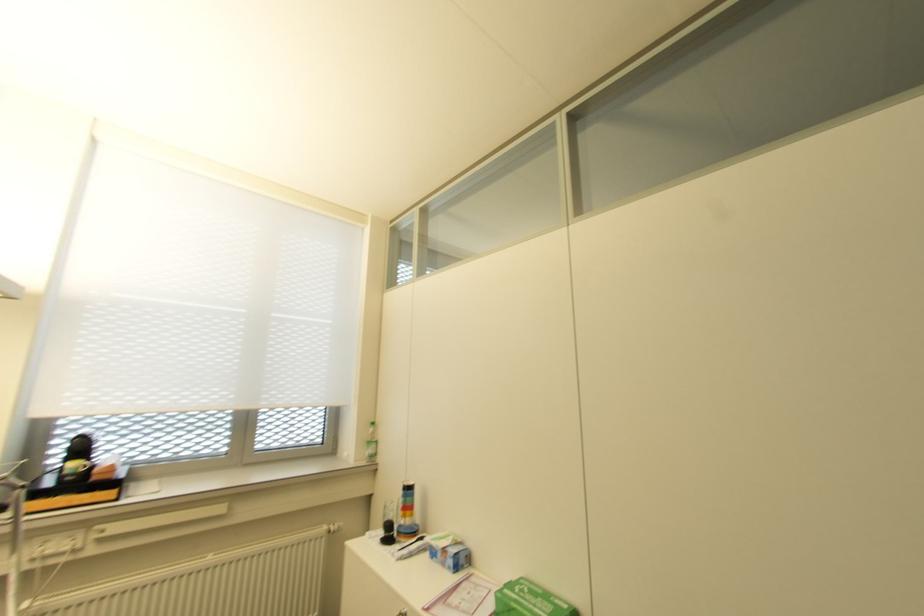
This screenshot has height=616, width=924. What are the coordinates of `green glove box` in the screenshot? It's located at [529, 600].